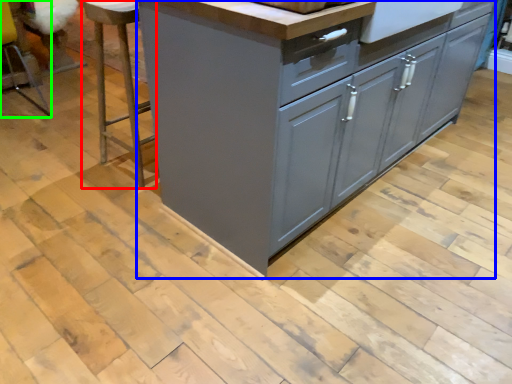
Question: Estimate the real-world distances between objects in this image. Which object is farther from bar stool (highlighted by a red box), chest of drawers (highlighted by a blue box) or bar stool (highlighted by a green box)?

Choices:
 (A) chest of drawers
 (B) bar stool

Answer: (B)